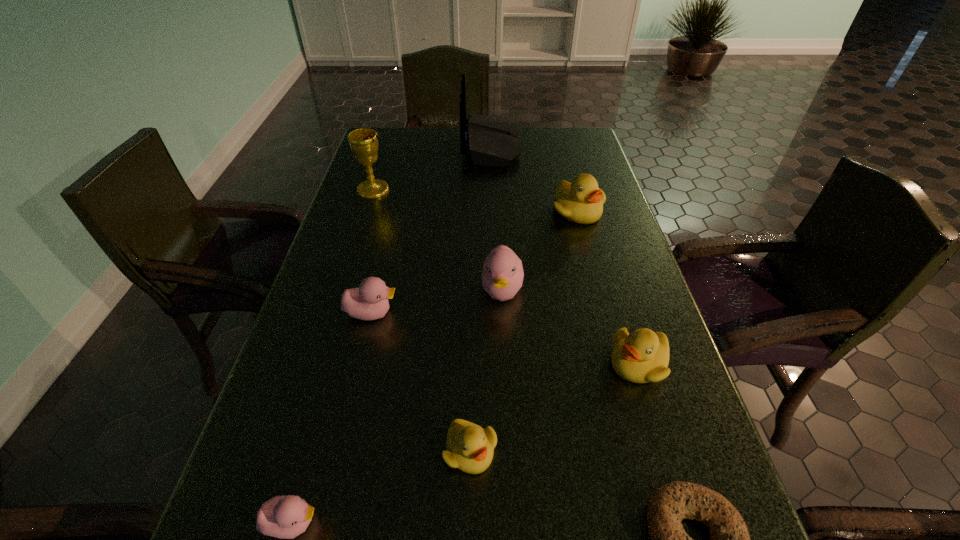
Identify which yellow duckling is the third nearest to the biggest pink duckling. Please provide its 2D coordinates. Your answer should be formatted as a tuple, i.e. [(x, y)], where the tuple contains the x and y coordinates of a point satisfying the conditions above.

[(470, 448)]

At what (x,y) coordinates should I click in order to perform the action: click on vacant space that satisfies the following two spatial constraints: 1. on the front-facing side of the farthest duckling; 2. on the front-facing side of the second smallest pink duckling. Please return your answer as a coordinate pair (x, y). This screenshot has width=960, height=540. Looking at the image, I should click on (605, 313).

Locate an element on the screen. This screenshot has width=960, height=540. vacant region that satisfies the following two spatial constraints: 1. on the front-facing side of the farthest duckling; 2. on the front-facing side of the second smallest pink duckling is located at coordinates pyautogui.click(x=605, y=313).

You are a GUI agent. You are given a task and a screenshot of the screen. Output one action in this format:
    pyautogui.click(x=<x>, y=<y>)
    Task: Click on the vacant area that satisfies the following two spatial constraints: 1. on the front-facing side of the farthest duckling; 2. on the front-facing side of the second smallest pink duckling
    This screenshot has height=540, width=960.
    Given the screenshot: What is the action you would take?
    pyautogui.click(x=605, y=313)

Image resolution: width=960 pixels, height=540 pixels. I want to click on vacant space that satisfies the following two spatial constraints: 1. on the front-facing side of the biggest pink duckling; 2. on the front-facing side of the second smallest pink duckling, so click(503, 313).